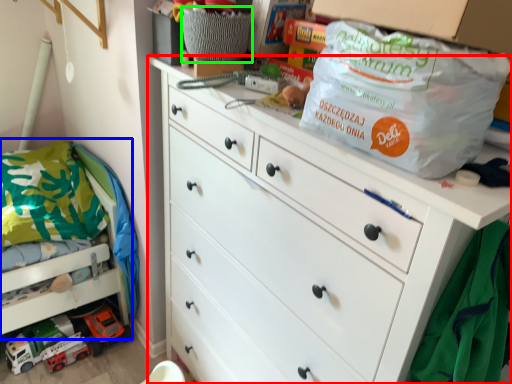
Question: Considering the real-world distances, which object is closest to chest of drawers (highlighted by a red box)? bunk bed (highlighted by a blue box) or basket (highlighted by a green box).

Choices:
 (A) bunk bed
 (B) basket

Answer: (B)